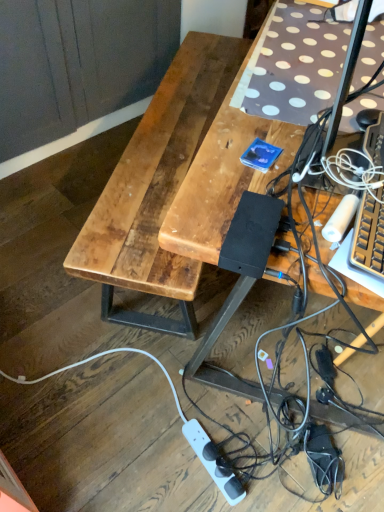
Image resolution: width=384 pixels, height=512 pixels. Find the location of `wooden desk at center`. wooden desk at center is located at coordinates (229, 218).

What do you see at coordinates (229, 218) in the screenshot? I see `wooden desk at center` at bounding box center [229, 218].

Identify the location of white plastic power strip at lower center. (213, 462).

This screenshot has width=384, height=512. Describe the element at coordinates (213, 462) in the screenshot. I see `white plastic power strip at lower center` at that location.

In order to face white plastic power strip at lower center, should I rotate leftwards or rightwards?

To align with it, rotate right about 2.715°.

Measure the distance between point (232, 489) and camera.

The distance of point (232, 489) from camera is 3.71 feet.

You are a GUI agent. You are given a task and a screenshot of the screen. Output one action in this format:
    pyautogui.click(x=<x>, y=<y>)
    Task: Click on the wooden desk at center
    The image size is (384, 512).
    Given the screenshot: What is the action you would take?
    pyautogui.click(x=229, y=218)

Consider the image. Which object is positioned more to the left, wooden desk at center or white plastic power strip at lower center?

From the viewer's perspective, white plastic power strip at lower center appears more on the left side.

Considering the relative positions of wooden desk at center and white plastic power strip at lower center in the image provided, is wooden desk at center in front of white plastic power strip at lower center?

Yes, wooden desk at center is in front of white plastic power strip at lower center.

Which point is more forward, [233,290] or [191,421]?

Positioned in front is point [233,290].

From the image's perspective, is wooden desk at center positioned above or below white plastic power strip at lower center?

wooden desk at center is situated higher than white plastic power strip at lower center in the image.

From a real-world perspective, is wooden desk at center on white plastic power strip at lower center?

Yes, from a real-world perspective, wooden desk at center is over white plastic power strip at lower center

Which of these two, wooden desk at center or white plastic power strip at lower center, is thinner?

Thinner between the two is white plastic power strip at lower center.

Considering the relative sizes of wooden desk at center and white plastic power strip at lower center in the image provided, is wooden desk at center taller than white plastic power strip at lower center?

Yes, wooden desk at center is taller than white plastic power strip at lower center.

Who is smaller, wooden desk at center or white plastic power strip at lower center?

white plastic power strip at lower center.

Is white plastic power strip at lower center a part of wooden desk at center?

No, white plastic power strip at lower center is not inside wooden desk at center.

Is the surface of wooden desk at center in direct contact with white plastic power strip at lower center?

wooden desk at center and white plastic power strip at lower center are not in contact.

Is wooden desk at center facing towards white plastic power strip at lower center?

No, wooden desk at center is not oriented towards white plastic power strip at lower center.

The width and height of the screenshot is (384, 512). Identify the location of power outlet on the left of wooden desk at center. (213, 462).

Is white plastic power strip at lower center at the right side of wooden desk at center?

No.

Which object is closer to the camera taking this photo, white plastic power strip at lower center or wooden desk at center?

wooden desk at center is more forward.

Is point (219, 473) positioned behind point (240, 253)?

Yes, it is.

From the image's perspective, which one is positioned lower, white plastic power strip at lower center or wooden desk at center?

white plastic power strip at lower center is shown below in the image.

Based on the photo, from a real-world perspective, is white plastic power strip at lower center located beneath wooden desk at center?

Yes, from a real-world perspective, white plastic power strip at lower center is under wooden desk at center.

In terms of width, does white plastic power strip at lower center look wider or thinner when compared to wooden desk at center?

white plastic power strip at lower center is thinner than wooden desk at center.

Is white plastic power strip at lower center taller or shorter than wooden desk at center?

In the image, white plastic power strip at lower center appears to be shorter than wooden desk at center.

Can you confirm if white plastic power strip at lower center is bigger than wooden desk at center?

Actually, white plastic power strip at lower center might be smaller than wooden desk at center.

Is white plastic power strip at lower center not inside wooden desk at center?

white plastic power strip at lower center is positioned outside wooden desk at center.

Is white plastic power strip at lower center in contact with wooden desk at center?

white plastic power strip at lower center and wooden desk at center are clearly separated.

Could you tell me if white plastic power strip at lower center is turned towards wooden desk at center?

No, white plastic power strip at lower center is not facing towards wooden desk at center.

Image resolution: width=384 pixels, height=512 pixels. I want to click on power outlet below the wooden desk at center (from a real-world perspective), so 213,462.

This screenshot has height=512, width=384. I want to click on power outlet located below the wooden desk at center (from the image's perspective), so click(213, 462).

Where is `power outlet below the wooden desk at center (from a real-world perspective)`? The image size is (384, 512). power outlet below the wooden desk at center (from a real-world perspective) is located at coordinates (213, 462).